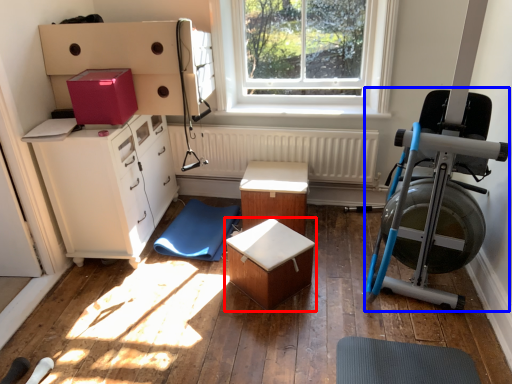
Question: Which object is closer to the camera taking this photo, table (highlighted by a red box) or baby carriage (highlighted by a blue box)?

Choices:
 (A) table
 (B) baby carriage

Answer: (B)